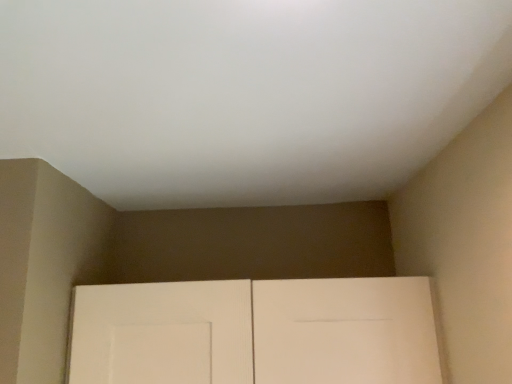
In order to face white matte door at lower center, should I rotate leftwards or rightwards?

You should rotate left by 0.150 degrees.

At what (x,y) coordinates should I click in order to perform the action: click on white matte door at lower center. Please return your answer as a coordinate pair (x, y). Looking at the image, I should click on (256, 332).

What is the approximate height of white matte door at lower center?

11.50 inches.

This screenshot has height=384, width=512. Describe the element at coordinates (256, 332) in the screenshot. I see `white matte door at lower center` at that location.

This screenshot has height=384, width=512. In order to click on white matte door at lower center in this screenshot , I will do `click(256, 332)`.